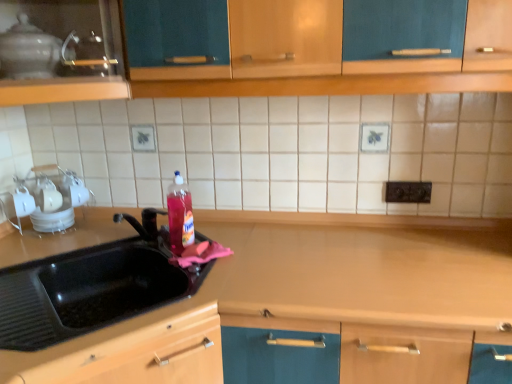
Question: Considering the relative positions of matte wood cabinet at upper left and black plastic electric outlet at upper center in the image provided, is matte wood cabinet at upper left to the right of black plastic electric outlet at upper center from the viewer's perspective?

Choices:
 (A) yes
 (B) no

Answer: (B)

Question: Is matte wood cabinet at upper left bigger than black plastic electric outlet at upper center?

Choices:
 (A) yes
 (B) no

Answer: (A)

Question: Is matte wood cabinet at upper left located outside black plastic electric outlet at upper center?

Choices:
 (A) no
 (B) yes

Answer: (B)

Question: From a real-world perspective, is matte wood cabinet at upper left physically above black plastic electric outlet at upper center?

Choices:
 (A) yes
 (B) no

Answer: (A)

Question: Does matte wood cabinet at upper left appear on the left side of black plastic electric outlet at upper center?

Choices:
 (A) yes
 (B) no

Answer: (A)

Question: Would you say wooden counter at center is to the left or to the right of white glossy dish rack at left, the 1th appliance from the back, in the picture?

Choices:
 (A) right
 (B) left

Answer: (A)

Question: Looking at the image, does wooden counter at center seem bigger or smaller compared to white glossy dish rack at left, the first appliance from the bottom?

Choices:
 (A) small
 (B) big

Answer: (B)

Question: From a real-world perspective, relative to white glossy dish rack at left, the second appliance positioned from the top, is wooden counter at center vertically above or below?

Choices:
 (A) below
 (B) above

Answer: (A)

Question: Considering the positions of point (438, 276) and point (41, 218), is point (438, 276) closer or farther from the camera than point (41, 218)?

Choices:
 (A) farther
 (B) closer

Answer: (B)

Question: Do you think matte wood cabinet at upper left is within glass teapot at upper left, which is the 1th appliance in front-to-back order, or outside of it?

Choices:
 (A) outside
 (B) inside

Answer: (A)

Question: Visually, is matte wood cabinet at upper left positioned to the left or to the right of glass teapot at upper left, which is the 1th appliance in front-to-back order?

Choices:
 (A) left
 (B) right

Answer: (A)

Question: From the image's perspective, is matte wood cabinet at upper left above or below glass teapot at upper left, which ranks as the 2th appliance in back-to-front order?

Choices:
 (A) above
 (B) below

Answer: (B)

Question: Looking at their shapes, would you say matte wood cabinet at upper left is wider or thinner than glass teapot at upper left, which is the 2th appliance in bottom-to-top order?

Choices:
 (A) wide
 (B) thin

Answer: (A)

Question: Considering the positions of black rubber sink at left and glass teapot at upper left, which is the 2th appliance in bottom-to-top order, in the image, is black rubber sink at left taller or shorter than glass teapot at upper left, which is the 2th appliance in bottom-to-top order,?

Choices:
 (A) short
 (B) tall

Answer: (B)

Question: From a real-world perspective, is black rubber sink at left above or below glass teapot at upper left, which is the 2th appliance in bottom-to-top order?

Choices:
 (A) below
 (B) above

Answer: (A)